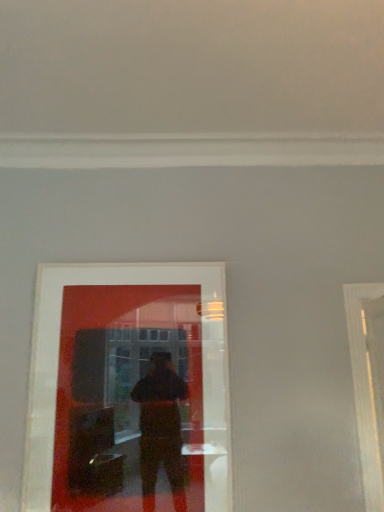
Question: From a real-world perspective, is white glossy door at right positioned under matte glass picture frame at center based on gravity?

Choices:
 (A) yes
 (B) no

Answer: (A)

Question: From the image's perspective, is white glossy door at right beneath matte glass picture frame at center?

Choices:
 (A) no
 (B) yes

Answer: (B)

Question: Considering the relative sizes of white glossy door at right and matte glass picture frame at center in the image provided, is white glossy door at right smaller than matte glass picture frame at center?

Choices:
 (A) no
 (B) yes

Answer: (A)

Question: Is white glossy door at right not near matte glass picture frame at center?

Choices:
 (A) yes
 (B) no

Answer: (A)

Question: Considering the relative positions of white glossy door at right and matte glass picture frame at center in the image provided, is white glossy door at right behind matte glass picture frame at center?

Choices:
 (A) yes
 (B) no

Answer: (B)

Question: Is white glossy door at right turned away from matte glass picture frame at center?

Choices:
 (A) no
 (B) yes

Answer: (B)

Question: Considering the relative sizes of matte glass picture frame at center and white glossy door at right in the image provided, is matte glass picture frame at center taller than white glossy door at right?

Choices:
 (A) no
 (B) yes

Answer: (B)

Question: Considering the relative sizes of matte glass picture frame at center and white glossy door at right in the image provided, is matte glass picture frame at center thinner than white glossy door at right?

Choices:
 (A) yes
 (B) no

Answer: (A)

Question: Is matte glass picture frame at center turned away from white glossy door at right?

Choices:
 (A) no
 (B) yes

Answer: (A)

Question: Does matte glass picture frame at center appear on the left side of white glossy door at right?

Choices:
 (A) yes
 (B) no

Answer: (A)

Question: Does matte glass picture frame at center have a greater width compared to white glossy door at right?

Choices:
 (A) yes
 (B) no

Answer: (B)

Question: Is white glossy door at right a part of matte glass picture frame at center?

Choices:
 (A) yes
 (B) no

Answer: (B)

Question: Looking at their shapes, would you say matte glass picture frame at center is wider or thinner than white glossy door at right?

Choices:
 (A) thin
 (B) wide

Answer: (A)